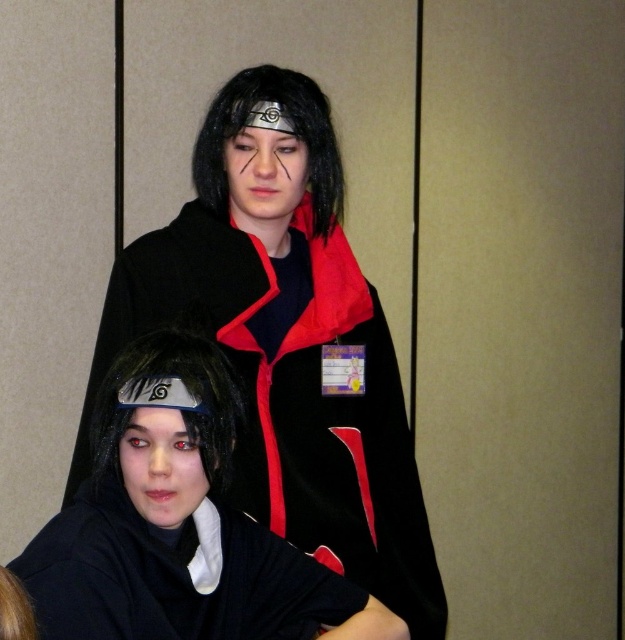
How much distance is there between black velvet robe at lower center and brown matte wig at lower left?

They are 10.67 inches apart.

Does black velvet robe at lower center have a greater width compared to brown matte wig at lower left?

Indeed, black velvet robe at lower center has a greater width compared to brown matte wig at lower left.

Who is more forward, [238,525] or [28,605]?

Point [28,605]

Where is `black velvet robe at lower center`? This screenshot has width=625, height=640. black velvet robe at lower center is located at coordinates (176, 579).

Can you confirm if velvet black cape at upper center is thinner than black velvet robe at lower center?

In fact, velvet black cape at upper center might be wider than black velvet robe at lower center.

In the scene shown: Can you confirm if velvet black cape at upper center is bigger than black velvet robe at lower center?

Indeed, velvet black cape at upper center has a larger size compared to black velvet robe at lower center.

Is point (326, 512) farther from viewer compared to point (271, 602)?

Yes, point (326, 512) is farther from viewer.

What are the coordinates of `velvet black cape at upper center` in the screenshot? It's located at (286, 340).

Can you confirm if black velvet robe at lower center is positioned to the left of slick black wig at lower center?

Incorrect, black velvet robe at lower center is not on the left side of slick black wig at lower center.

Which of these two, black velvet robe at lower center or slick black wig at lower center, stands shorter?

With less height is black velvet robe at lower center.

Is point (208, 563) behind point (121, 403)?

Yes, it is.

Find the location of a particular element. The image size is (625, 640). black velvet robe at lower center is located at coordinates (176, 579).